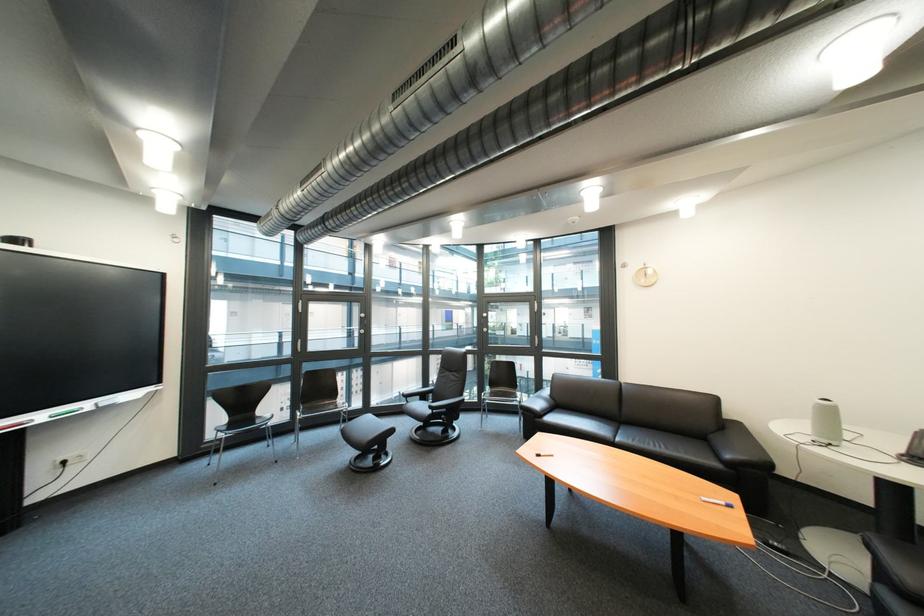
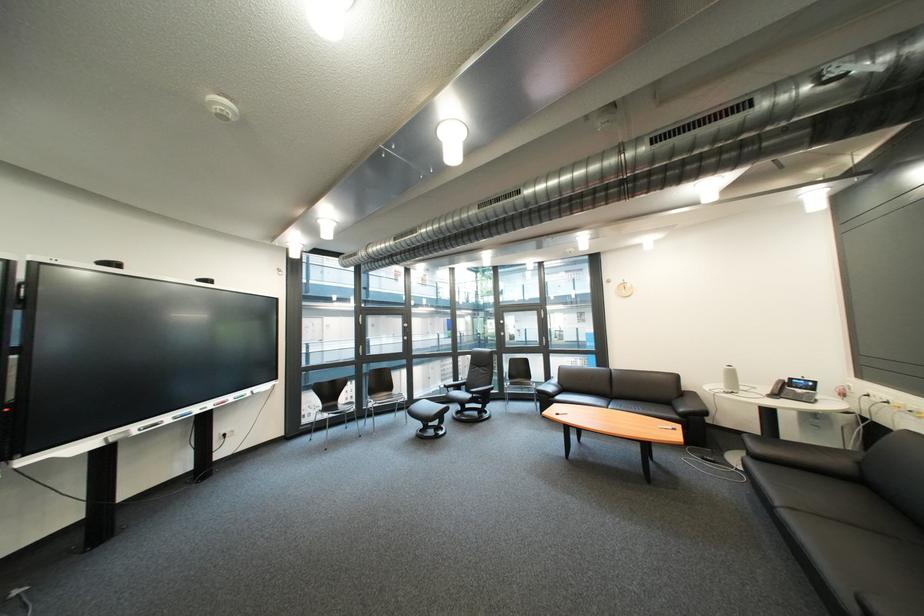
Locate, in the second image, the point that corresponds to point 551,406 in the first image.

(563, 389)